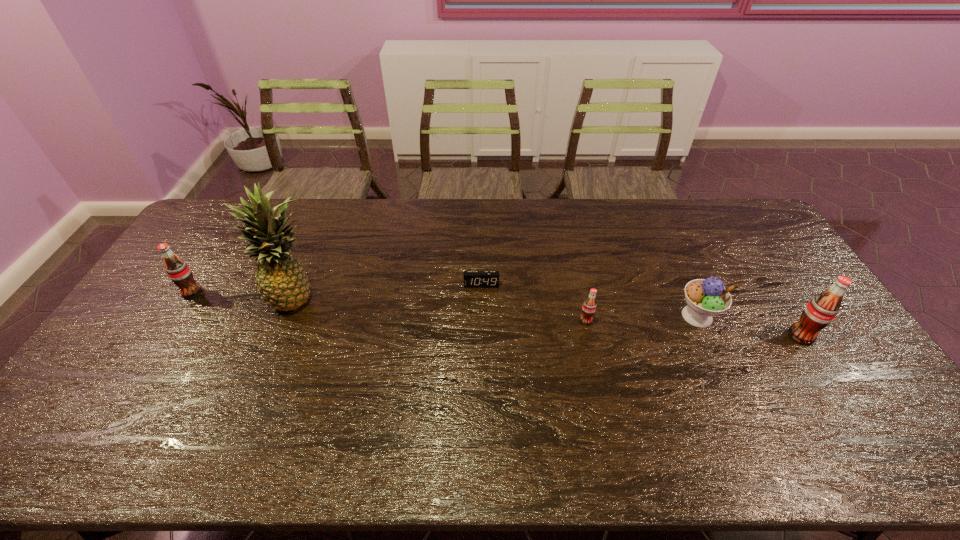
Find the location of `the leftmost soda`. the leftmost soda is located at coordinates (178, 271).

Locate an element on the screen. the farthest soda is located at coordinates (178, 271).

This screenshot has width=960, height=540. Find the location of `the shortest soda`. the shortest soda is located at coordinates (589, 306).

Image resolution: width=960 pixels, height=540 pixels. I want to click on the second shortest object, so click(589, 306).

Identify the location of the nearest soda. (821, 310).

The width and height of the screenshot is (960, 540). What are the coordinates of `the rightmost soda` in the screenshot? It's located at (821, 310).

At what (x,y) coordinates should I click in order to perform the action: click on the fifth object from left to right. Please return your answer as a coordinate pair (x, y). Looking at the image, I should click on (705, 298).

I want to click on icecream, so click(705, 298).

Locate an element on the screen. This screenshot has width=960, height=540. the tallest object is located at coordinates (282, 282).

Locate an element on the screen. pineapple is located at coordinates (x=282, y=282).